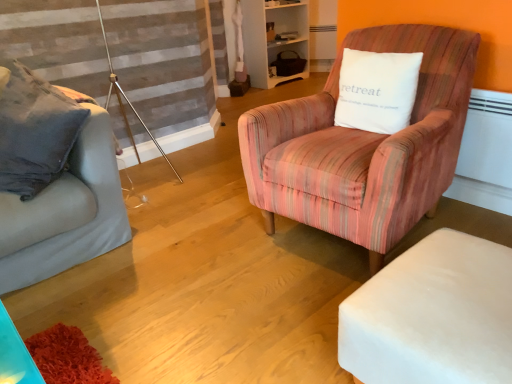
Question: Considering the positions of white soft cushion at upper right and matte gray couch at left in the image, is white soft cushion at upper right taller or shorter than matte gray couch at left?

Choices:
 (A) tall
 (B) short

Answer: (B)

Question: From the image's perspective, is white soft cushion at upper right above or below matte gray couch at left?

Choices:
 (A) below
 (B) above

Answer: (B)

Question: Which of these objects is positioned closest to the white wood bookshelf at upper center?

Choices:
 (A) white fabric ottoman at lower right
 (B) pink striped fabric armchair at center
 (C) white soft cushion at upper right
 (D) matte gray couch at left

Answer: (C)

Question: Which of these objects is positioned farthest from the matte gray couch at left?

Choices:
 (A) pink striped fabric armchair at center
 (B) white soft cushion at upper right
 (C) white wood bookshelf at upper center
 (D) white fabric ottoman at lower right

Answer: (C)